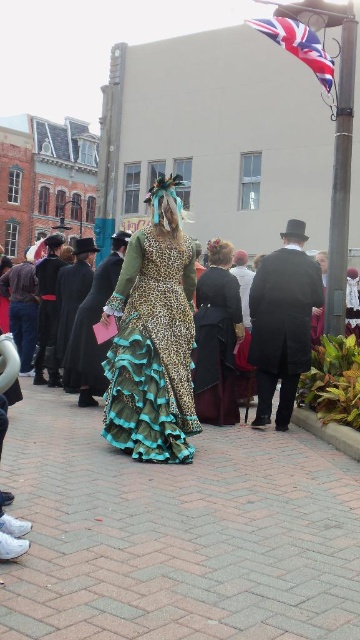
Question: Which object is the closest to the brown leather coat at left?

Choices:
 (A) velvet black dress at center
 (B) metallic pole at upper right
 (C) matte black coat at center
 (D) black wool coat at left

Answer: (D)

Question: From the image, what is the correct spatial relationship of velvet black dress at center in relation to matte black coat at left?

Choices:
 (A) above
 (B) below

Answer: (B)

Question: Is leopard print dress at center closer to camera compared to brown leather coat at left?

Choices:
 (A) yes
 (B) no

Answer: (A)

Question: Which is nearer to the union jack fabric at upper right?

Choices:
 (A) black wool coat at left
 (B) matte black coat at left
 (C) brown leather coat at left

Answer: (A)

Question: Which of the following is the closest to the observer?

Choices:
 (A) union jack fabric at upper right
 (B) brown leather coat at left
 (C) leopard print dress at center
 (D) matte black coat at left

Answer: (C)

Question: Is smooth black coat at center smaller than velvet black dress at center?

Choices:
 (A) yes
 (B) no

Answer: (B)